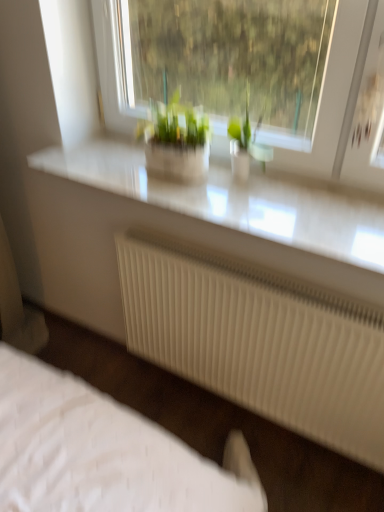
The image size is (384, 512). Identify the location of free space to the right of green glass vase at center, which is the first houseplant in right-to-left order. (311, 187).